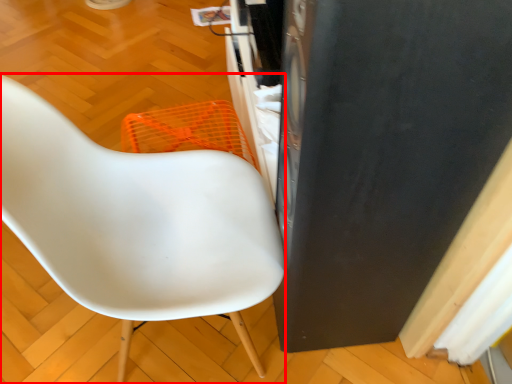
Question: Where is chair (annotated by the red box) located in relation to appliance in the image?

Choices:
 (A) left
 (B) right

Answer: (A)